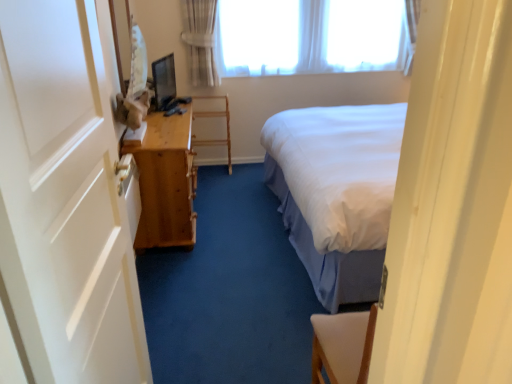
Question: Is white sheer curtain at upper center positioned beyond the bounds of white painted wood door at left?

Choices:
 (A) no
 (B) yes

Answer: (B)

Question: From a real-world perspective, is white sheer curtain at upper center positioned over white painted wood door at left based on gravity?

Choices:
 (A) yes
 (B) no

Answer: (A)

Question: Is white sheer curtain at upper center bigger than white painted wood door at left?

Choices:
 (A) yes
 (B) no

Answer: (A)

Question: Can you confirm if white sheer curtain at upper center is shorter than white painted wood door at left?

Choices:
 (A) yes
 (B) no

Answer: (A)

Question: Considering the relative sizes of white sheer curtain at upper center and white painted wood door at left in the image provided, is white sheer curtain at upper center wider than white painted wood door at left?

Choices:
 (A) no
 (B) yes

Answer: (B)

Question: In terms of width, does light brown wooden table at left look wider or thinner when compared to white sheer curtain at upper center?

Choices:
 (A) thin
 (B) wide

Answer: (B)

Question: From a real-world perspective, relative to white sheer curtain at upper center, is light brown wooden table at left vertically above or below?

Choices:
 (A) above
 (B) below

Answer: (B)

Question: Based on their positions, is light brown wooden table at left located to the left or right of white sheer curtain at upper center?

Choices:
 (A) right
 (B) left

Answer: (B)

Question: Considering the positions of light brown wooden table at left and white sheer curtain at upper center in the image, is light brown wooden table at left taller or shorter than white sheer curtain at upper center?

Choices:
 (A) short
 (B) tall

Answer: (B)

Question: From a real-world perspective, is white sheer curtain at upper center physically located above or below wooden shelf at center?

Choices:
 (A) above
 (B) below

Answer: (A)

Question: In terms of size, does white sheer curtain at upper center appear bigger or smaller than wooden shelf at center?

Choices:
 (A) big
 (B) small

Answer: (A)

Question: Is white sheer curtain at upper center spatially inside wooden shelf at center, or outside of it?

Choices:
 (A) outside
 (B) inside

Answer: (A)

Question: Looking at their shapes, would you say white sheer curtain at upper center is wider or thinner than wooden shelf at center?

Choices:
 (A) thin
 (B) wide

Answer: (A)

Question: From the image's perspective, is white sheer curtain at upper center above or below white painted wood door at left?

Choices:
 (A) below
 (B) above

Answer: (B)

Question: From a real-world perspective, is white sheer curtain at upper center physically located above or below white painted wood door at left?

Choices:
 (A) below
 (B) above

Answer: (B)